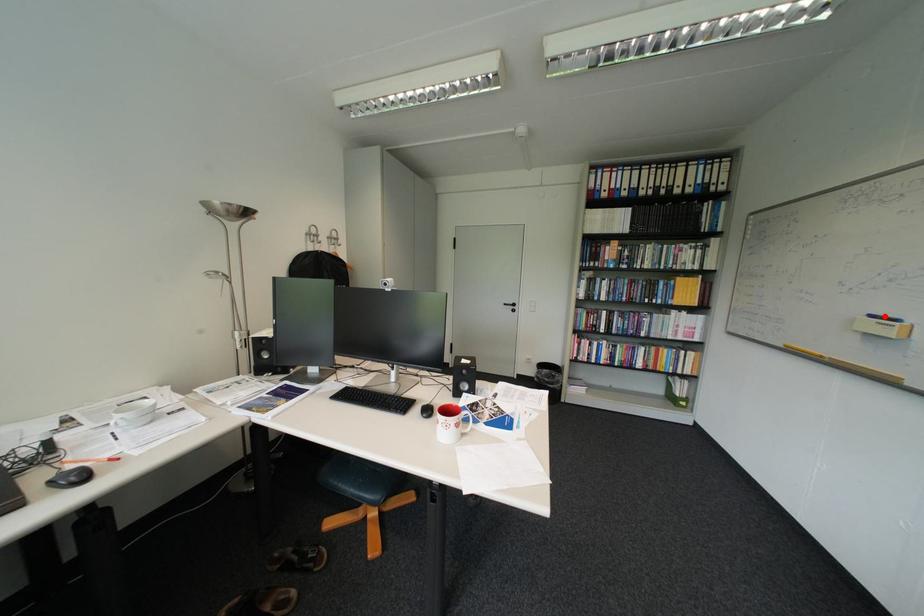
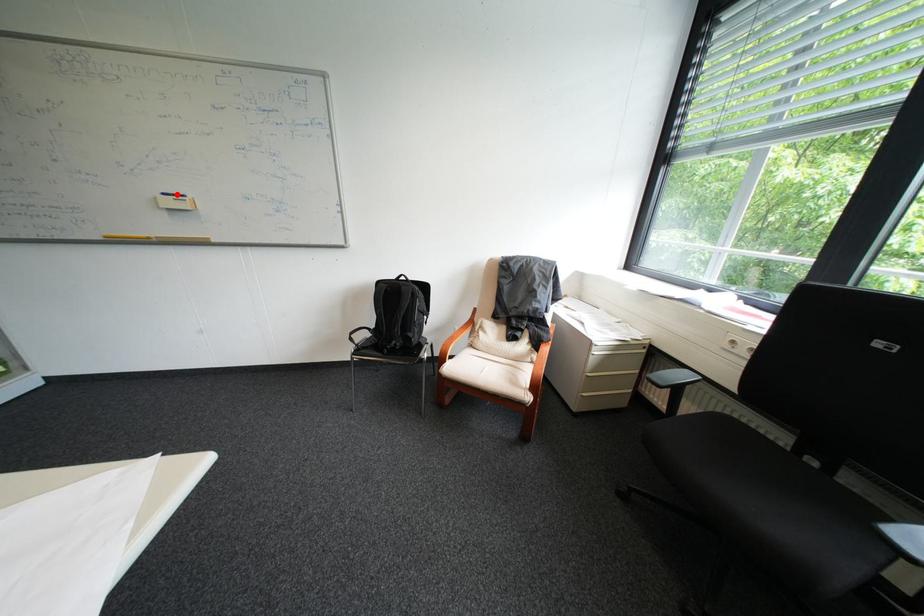
I am providing you with two images of the same scene from different viewpoints. A red point is marked on the first image and another point is marked on the second image. Are the points marked in image1 and image2 representing the same 3D position?

Yes